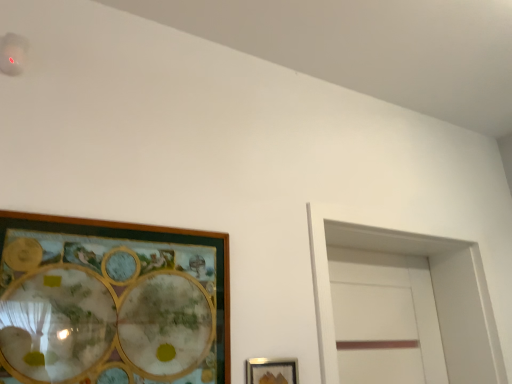
Question: Would you say metallic silver picture frame at lower center, the 2th picture frame from the top, is inside or outside white matte glass door at right?

Choices:
 (A) inside
 (B) outside

Answer: (B)

Question: Considering the positions of metallic silver picture frame at lower center, the first picture frame ordered from the bottom, and white matte glass door at right in the image, is metallic silver picture frame at lower center, the first picture frame ordered from the bottom, wider or thinner than white matte glass door at right?

Choices:
 (A) thin
 (B) wide

Answer: (A)

Question: Which of these objects is positioned farthest from the wooden picture frame at left, which is the first picture frame in top-to-bottom order?

Choices:
 (A) metallic silver picture frame at lower center, positioned as the second picture frame in left-to-right order
 (B) white matte glass door at right

Answer: (B)

Question: Which of these objects is positioned closest to the wooden picture frame at left, the second picture frame when ordered from bottom to top?

Choices:
 (A) white matte glass door at right
 (B) metallic silver picture frame at lower center, the first picture frame ordered from the bottom

Answer: (B)